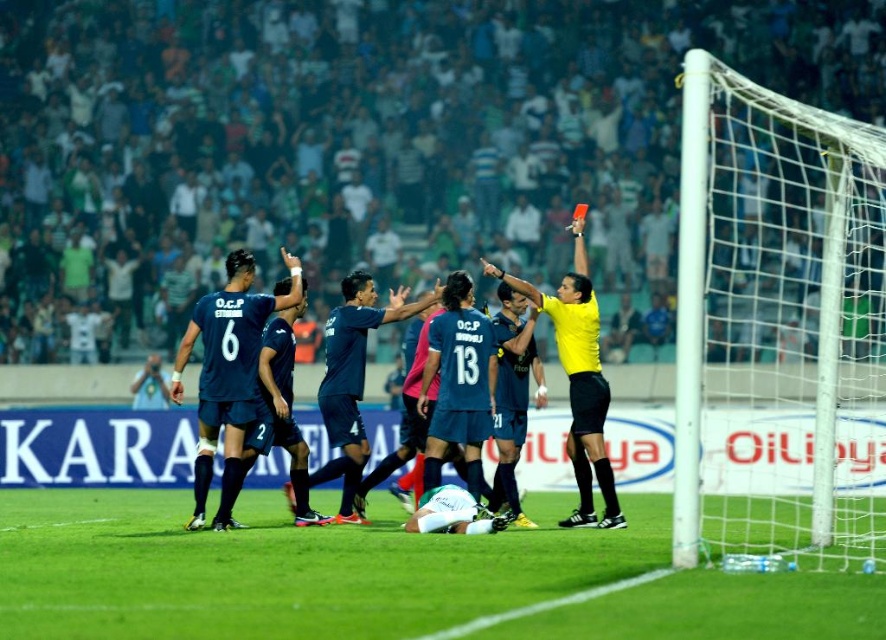
Question: Which point is farther to the camera?

Choices:
 (A) (362, 289)
 (B) (263, 506)

Answer: (B)

Question: Is dark blue jersey at center thinner than yellow jersey at center?

Choices:
 (A) no
 (B) yes

Answer: (B)

Question: Among these points, which one is farthest from the camera?

Choices:
 (A) (577, 451)
 (B) (821, 557)
 (C) (573, 448)

Answer: (C)

Question: Which object is the closest to the yellow jersey at center?

Choices:
 (A) white mesh net at right
 (B) green grass at lower center
 (C) dark blue jersey at center

Answer: (C)

Question: Is green grass at lower center positioned behind yellow jersey at center?

Choices:
 (A) yes
 (B) no

Answer: (B)

Question: Does white mesh net at right have a greater width compared to green grass at lower center?

Choices:
 (A) no
 (B) yes

Answer: (A)